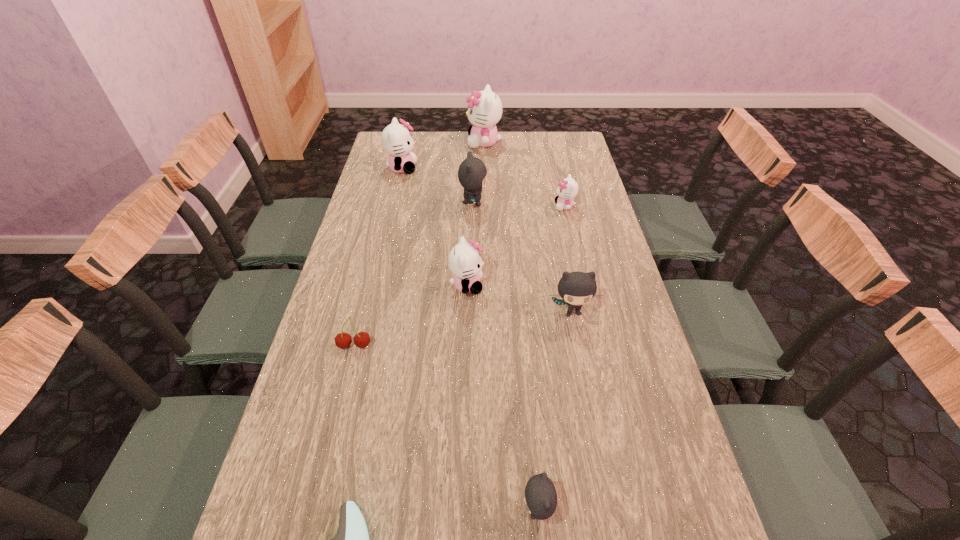
Find the location of a particular element. free space located 0.220m on the front-facing side of the rightmost white kitten is located at coordinates (493, 206).

The height and width of the screenshot is (540, 960). I want to click on free space located 0.240m on the front-facing side of the rightmost white kitten, so click(x=488, y=206).

In order to click on free spot located on the surface of the seventh farthest object in this screenshot , I will do `click(338, 413)`.

Identify the location of kitten that is positioned at the left edge. This screenshot has width=960, height=540. (397, 141).

Locate an element on the screen. The width and height of the screenshot is (960, 540). cherry located at the left edge is located at coordinates (362, 339).

Find the location of a particular element. Image resolution: width=960 pixels, height=540 pixels. object located at the far left corner is located at coordinates (397, 141).

Identify the location of vacant area at the far edge. (491, 157).

In the image, there is a desktop. Where is `free space at the left edge`? free space at the left edge is located at coordinates (335, 504).

Identify the location of vacant space at the right edge of the desktop. (552, 190).

Locate an element on the screen. The image size is (960, 540). free space between the third biggest white kitten and the rightmost white kitten is located at coordinates (516, 246).